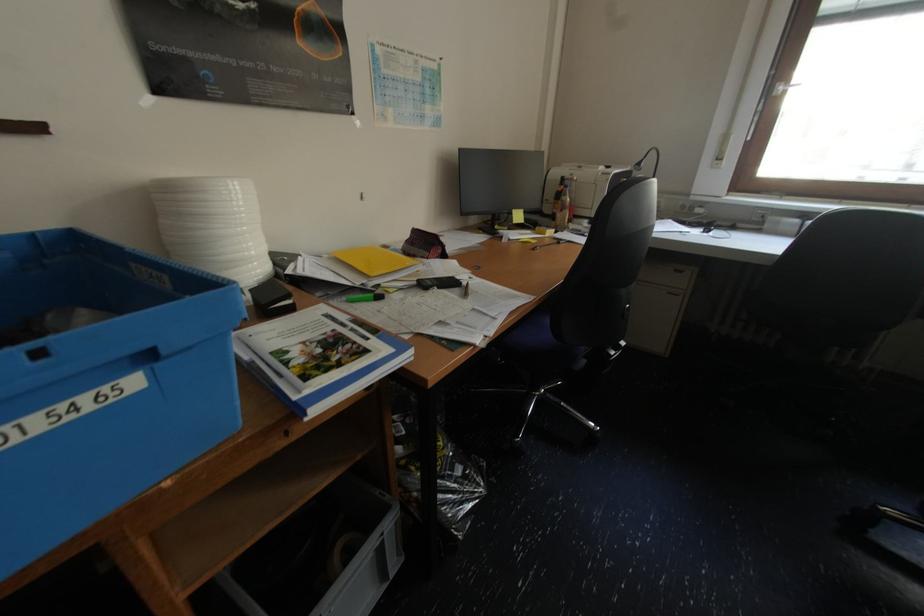
At what (x,y) coordinates should I click in order to perform the action: click on glass bottle. Please return your answer as a coordinate pair (x, y). The width and height of the screenshot is (924, 616). Looking at the image, I should click on (564, 208).